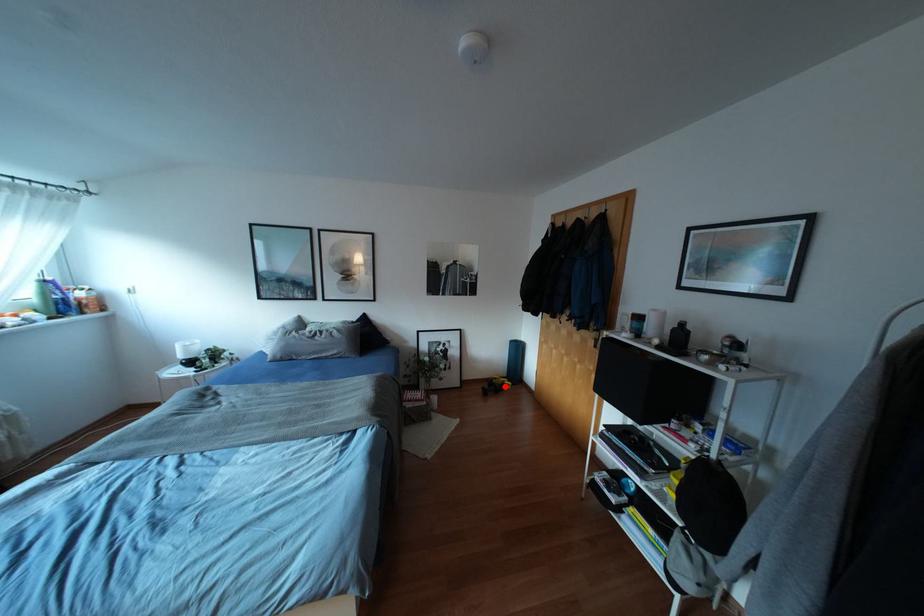
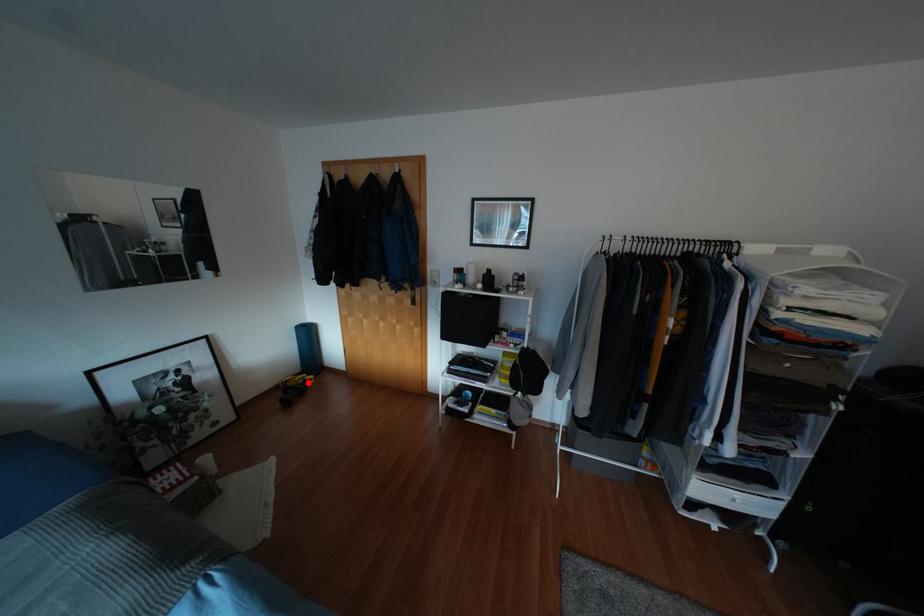
I am providing you with two images of the same scene from different viewpoints. A red point is marked on the first image and another point is marked on the second image. Is the marked point in image1 the same physical position as the marked point in image2?

Yes